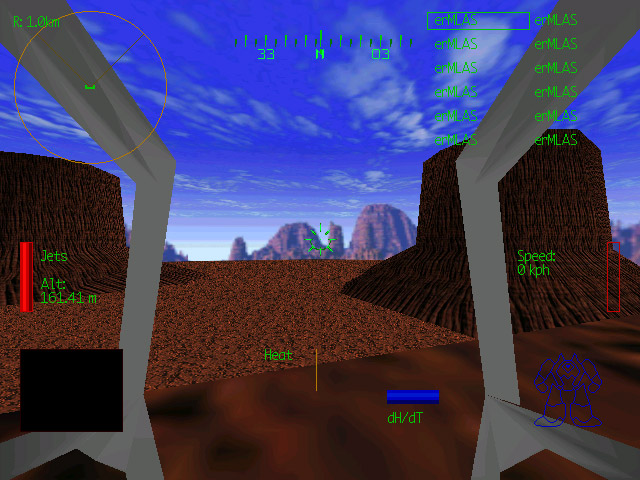
What are the coordinates of `mesa` in the screenshot? It's located at (570, 231), (611, 274), (432, 278), (82, 210), (176, 271), (10, 292).